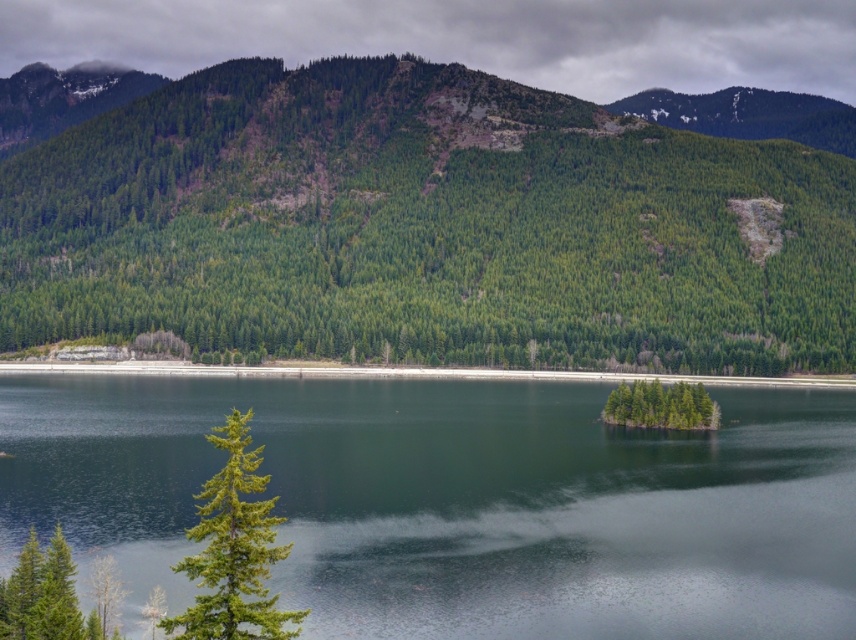
You are an environmental scientist assessing the ecological balance of the landscape. You observe the green matte tree at center and the green matte island at center. Which object has a greater width according to your measurements?

The green matte tree at center has a greater width than the green matte island at center as stated in the description.